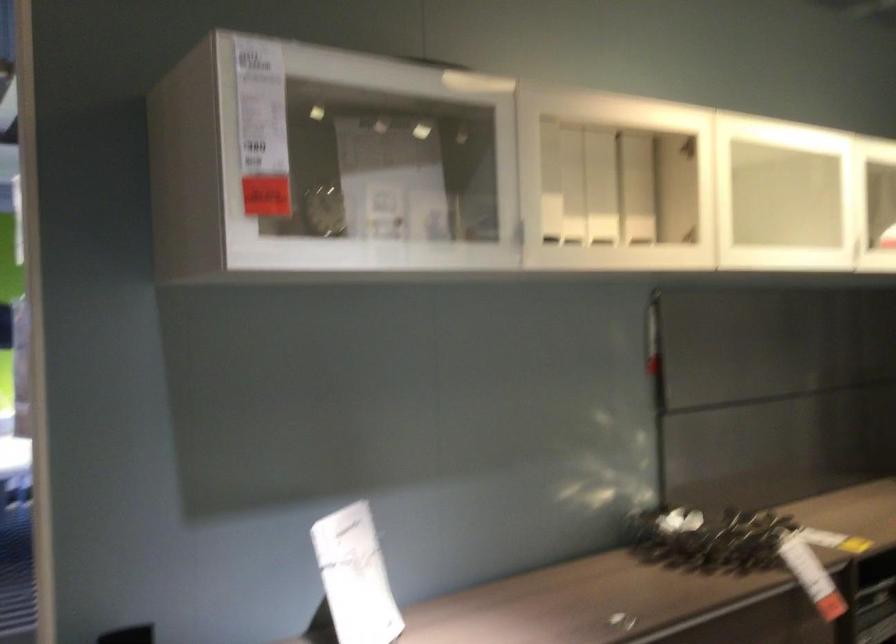
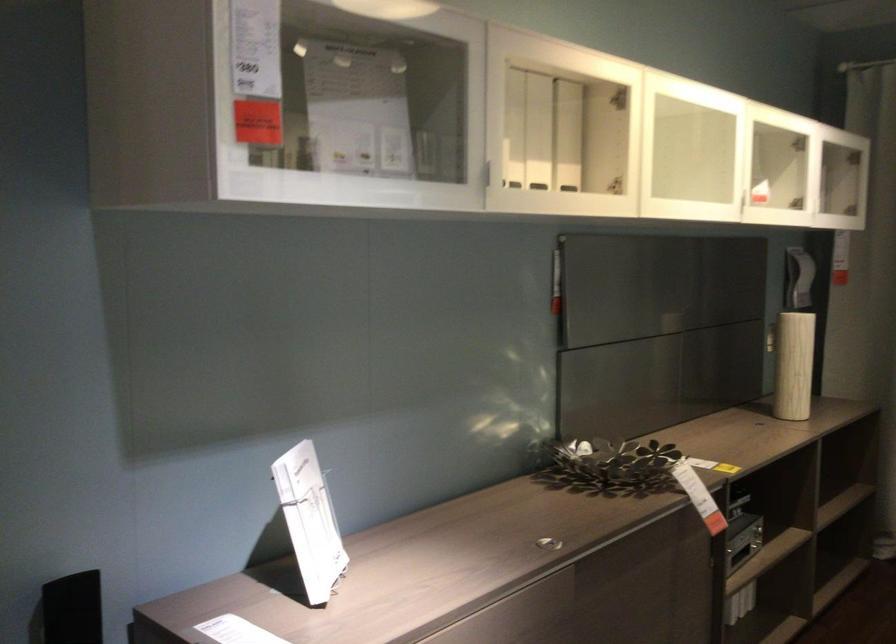
Where in the second image is the point corresponding to point (565, 185) from the first image?

(513, 128)